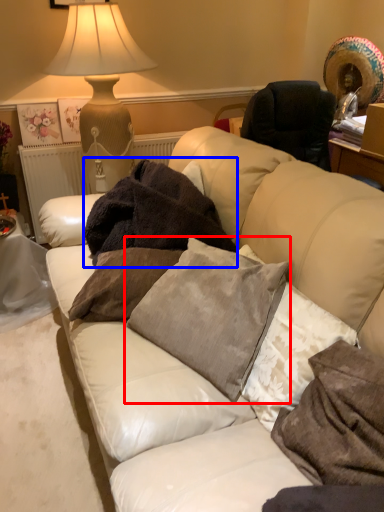
Question: Which point is further to the camera, pillow (highlighted by a red box) or blanket (highlighted by a blue box)?

Choices:
 (A) pillow
 (B) blanket

Answer: (B)